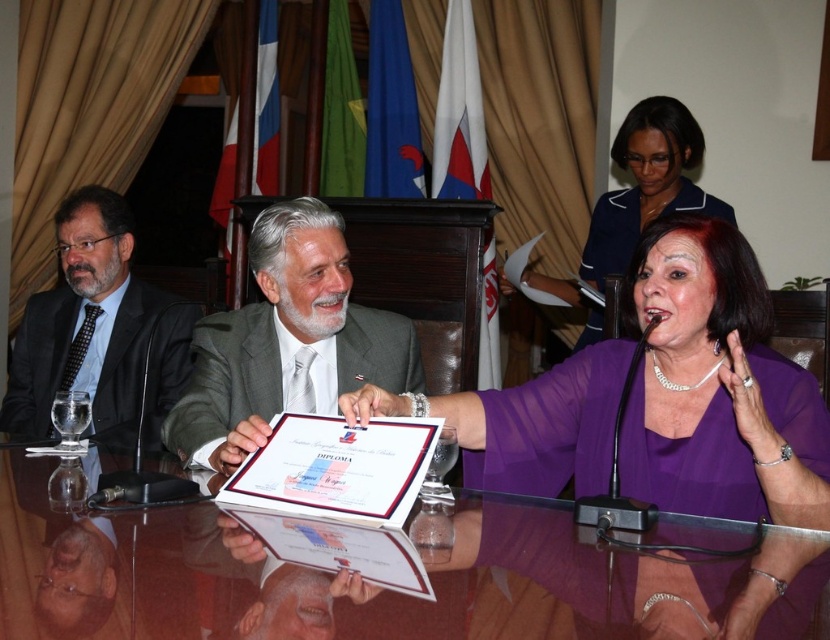
You are organizing a small event and need to place a 1.2 meter wide banner on the table. Given the transparent glass table at center and the purple sheer blouse at center, can the banner fit on the table?

The transparent glass table at center might be wider than purple sheer blouse at center, but without specific measurements for the table itself, it is uncertain if the banner will fit. Consider checking the table dimensions before placing the banner.

You are a photographer standing at the camera position. You want to capture a clear reflection of the certificate being held by the man in the light gray suit on the transparent glass table at center. Considering the distance between the camera and the table, can you adjust your position to ensure the reflection is visible in the photo?

The transparent glass table at center and camera are 83.79 centimeters apart from each other. To capture the reflection of the certificate, you need to position yourself so that the camera is at an angle where the reflection is visible. Since the distance is manageable, adjusting your position slightly should allow you to frame the reflection properly in the photo.

You are sitting at the polished wooden table and want to place a small object on the table. There are two points marked on the table surface. The first point is at coordinates point (250, 588) and the second is at point (728, 480). Which of these two points is closer to you, the observer, when looking at the table?

Point (250, 588) is in front of point (728, 480), so it is closer to you.